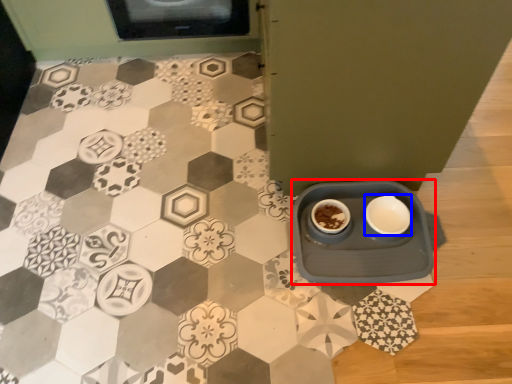
Question: Which object is further to the camera taking this photo, table (highlighted by a red box) or tableware (highlighted by a blue box)?

Choices:
 (A) table
 (B) tableware

Answer: (B)